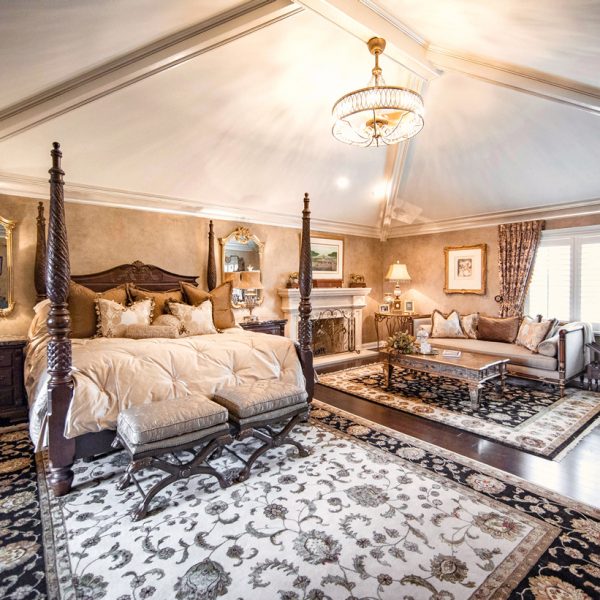
Find the location of a particular element. This screenshot has width=600, height=600. stool is located at coordinates (187, 415).